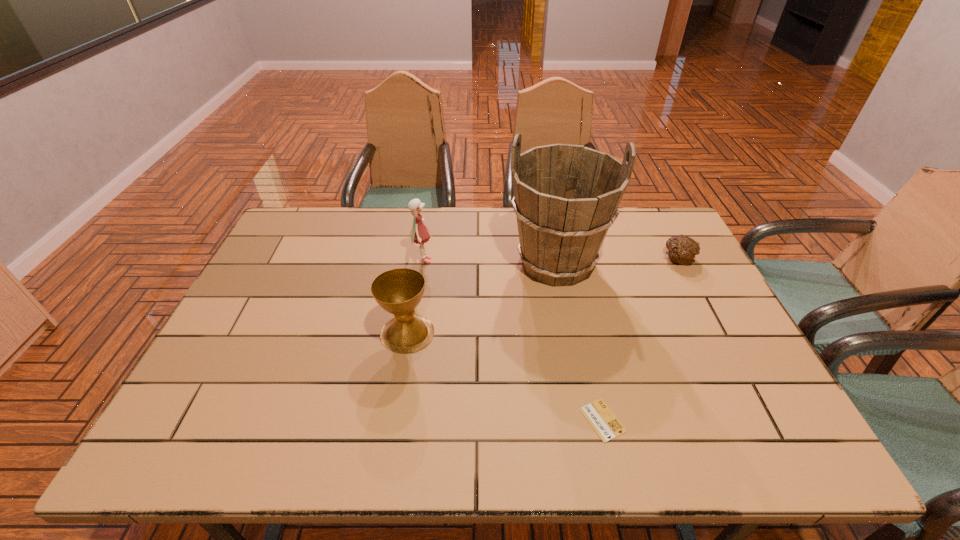
This screenshot has height=540, width=960. Find the location of `free spot between the rightmost object and the bucket`. free spot between the rightmost object and the bucket is located at coordinates (616, 261).

Locate an element on the screen. The width and height of the screenshot is (960, 540). vacant space that is in between the muffin and the shortest object is located at coordinates (640, 339).

Point out which object is positioned as the second nearest to the doll. Please provide its 2D coordinates. Your answer should be formatted as a tuple, i.e. [(x, y)], where the tuple contains the x and y coordinates of a point satisfying the conditions above.

[(566, 197)]

Identify which object is located as the third nearest to the second tallest object. Please provide its 2D coordinates. Your answer should be formatted as a tuple, i.e. [(x, y)], where the tuple contains the x and y coordinates of a point satisfying the conditions above.

[(606, 425)]

At what (x,y) coordinates should I click in order to perform the action: click on vacant space that satisfies the following two spatial constraints: 1. on the front side of the fourth tallest object; 2. on the front-facing side of the doll. Please return your answer as a coordinate pair (x, y). The width and height of the screenshot is (960, 540). Looking at the image, I should click on (679, 260).

Identify the location of vacant space that satisfies the following two spatial constraints: 1. on the front-facing side of the second tallest object; 2. on the right side of the shortest object. This screenshot has height=540, width=960. (399, 420).

The image size is (960, 540). I want to click on free space that satisfies the following two spatial constraints: 1. on the front-facing side of the identity card; 2. on the left side of the doll, so pyautogui.click(x=399, y=420).

The image size is (960, 540). Identify the location of free point that satisfies the following two spatial constraints: 1. on the back side of the third tallest object; 2. on the left side of the bucket. (419, 264).